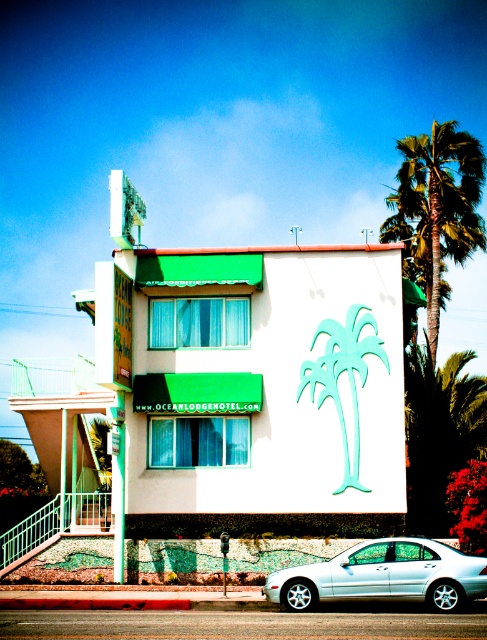
I want to click on green leafy palm tree at upper right, so click(x=436, y=211).

Between green leafy palm tree at upper right and white metallic car at lower center, which one has more height?

green leafy palm tree at upper right

Locate an element on the screen. The width and height of the screenshot is (487, 640). green leafy palm tree at upper right is located at coordinates (436, 211).